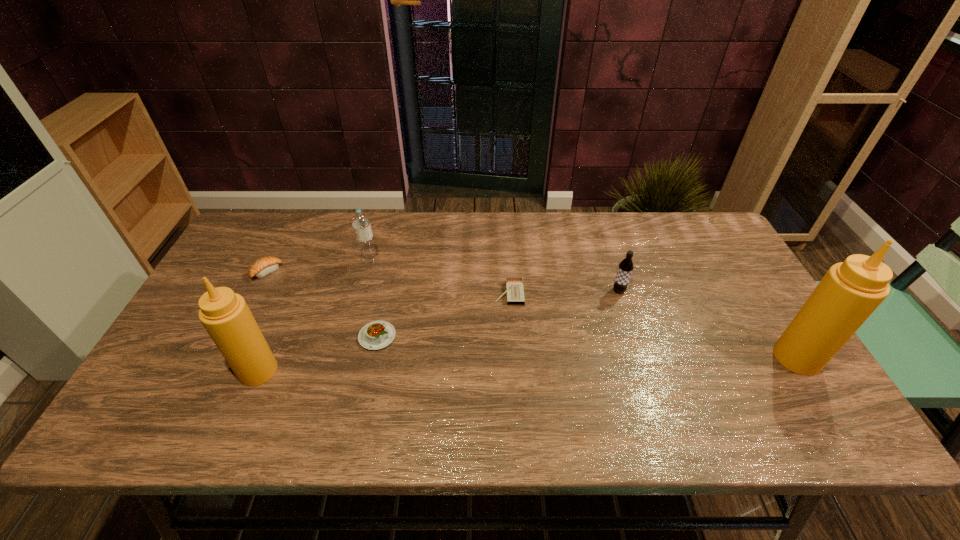
You are a GUI agent. You are given a task and a screenshot of the screen. Output one action in this format:
    pyautogui.click(x=<x>, y=<y>)
    Task: Click on the pudding
    This screenshot has width=960, height=540.
    Given the screenshot: What is the action you would take?
    tap(375, 335)

This screenshot has width=960, height=540. I want to click on blank space located on the right of the second object from left to right, so [x=393, y=370].

The height and width of the screenshot is (540, 960). Identify the location of vacant space located 0.060m on the front of the taller condiment. (823, 399).

Image resolution: width=960 pixels, height=540 pixels. Find the location of `free space located on the back of the fifth shortest object`. free space located on the back of the fifth shortest object is located at coordinates (380, 225).

This screenshot has width=960, height=540. Find the location of `free space located 0.360m on the left of the fourth shortest object`. free space located 0.360m on the left of the fourth shortest object is located at coordinates (486, 291).

The height and width of the screenshot is (540, 960). I want to click on blank space located on the striking surface of the third object from right to left, so click(x=470, y=294).

Locate an element on the screen. vacant space located on the striking surface of the third object from right to left is located at coordinates (460, 294).

You are a GUI agent. You are given a task and a screenshot of the screen. Output one action in this format:
    pyautogui.click(x=<x>, y=<y>)
    Task: Click on the vacant space positioned on the striking surface of the third object from right to left
    
    Given the screenshot: What is the action you would take?
    pos(372,294)

I want to click on free space located on the front of the leftmost object, so click(x=228, y=348).

At what (x,y) coordinates should I click in order to perform the action: click on vacant region located on the left of the pudding. Please return your answer as a coordinate pair (x, y). Looking at the image, I should click on (281, 336).